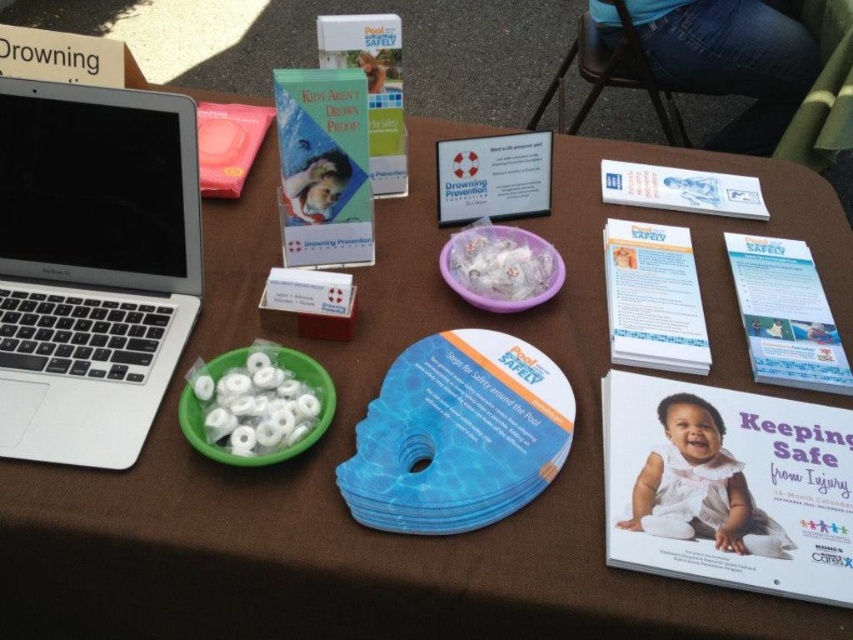
Is silver/black plastic laptop at left to the left of white matte baby at center from the viewer's perspective?

Indeed, silver/black plastic laptop at left is positioned on the left side of white matte baby at center.

Does silver/black plastic laptop at left have a lesser height compared to white matte baby at center?

In fact, silver/black plastic laptop at left may be taller than white matte baby at center.

Is point (38, 266) less distant than point (757, 532)?

No, (38, 266) is further to viewer.

The height and width of the screenshot is (640, 853). Identify the location of silver/black plastic laptop at left. (91, 266).

Does jeans at upper right appear over white matte baby at center?

Yes, jeans at upper right is above white matte baby at center.

Between point (804, 52) and point (712, 468), which one is positioned in front?

Point (712, 468) is in front.

Find the location of a particular element. jeans at upper right is located at coordinates (730, 60).

Can you confirm if silver/black plastic laptop at left is taller than jeans at upper right?

In fact, silver/black plastic laptop at left may be shorter than jeans at upper right.

Is silver/black plastic laptop at left behind jeans at upper right?

No, silver/black plastic laptop at left is in front of jeans at upper right.

Is point (96, 301) in front of point (770, 28)?

Yes, it is in front of point (770, 28).

Locate an element on the screen. silver/black plastic laptop at left is located at coordinates (91, 266).